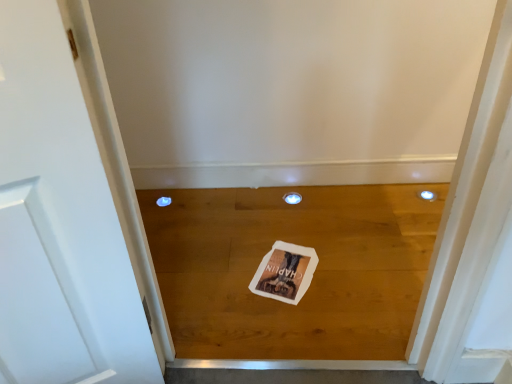
Locate an element on the screen. The height and width of the screenshot is (384, 512). space that is in front of white paper postcard at center is located at coordinates (290, 320).